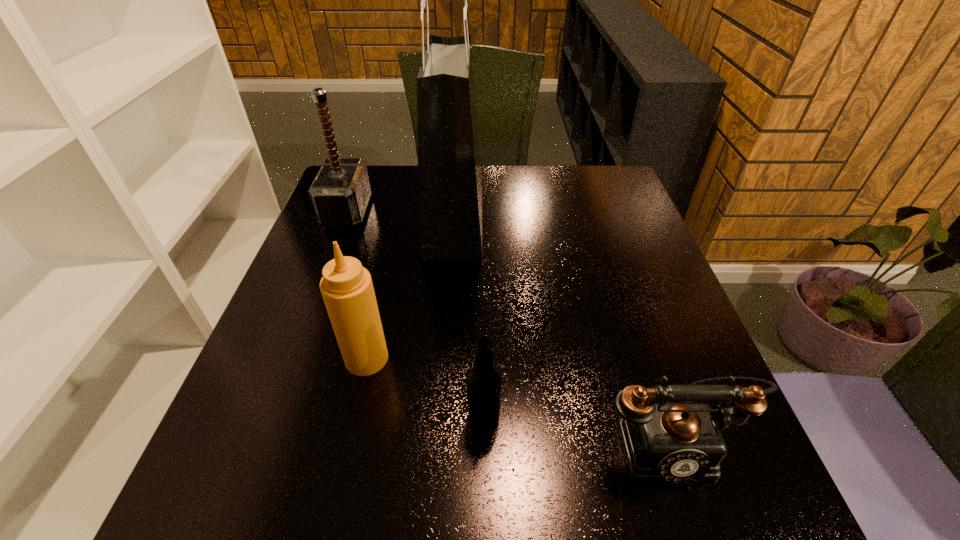
This screenshot has width=960, height=540. Identify the location of free region at the right edge. (707, 359).

Find the location of a particular element. free location at the far right corner of the desktop is located at coordinates (590, 198).

This screenshot has width=960, height=540. What are the coordinates of `empty space that is in between the beer bottle and the fourth object from right to left` in the screenshot? It's located at (425, 388).

This screenshot has height=540, width=960. Find the location of `empty location between the third tallest object and the beer bottle`. empty location between the third tallest object and the beer bottle is located at coordinates coord(425,388).

Image resolution: width=960 pixels, height=540 pixels. I want to click on empty space between the third tallest object and the tallest object, so click(x=411, y=288).

Locate an element on the screen. This screenshot has height=540, width=960. free space between the second object from left to right and the shopping bag is located at coordinates (411, 288).

Identify the location of vacant point located between the telephone and the beer bottle. (576, 430).

Locate an element on the screen. vacant area between the beer bottle and the hammer is located at coordinates (416, 315).

Locate an element on the screen. empty location between the telephone and the third shortest object is located at coordinates (517, 400).

This screenshot has height=540, width=960. Find the location of `free spot between the third farthest object and the beer bottle`. free spot between the third farthest object and the beer bottle is located at coordinates (425, 388).